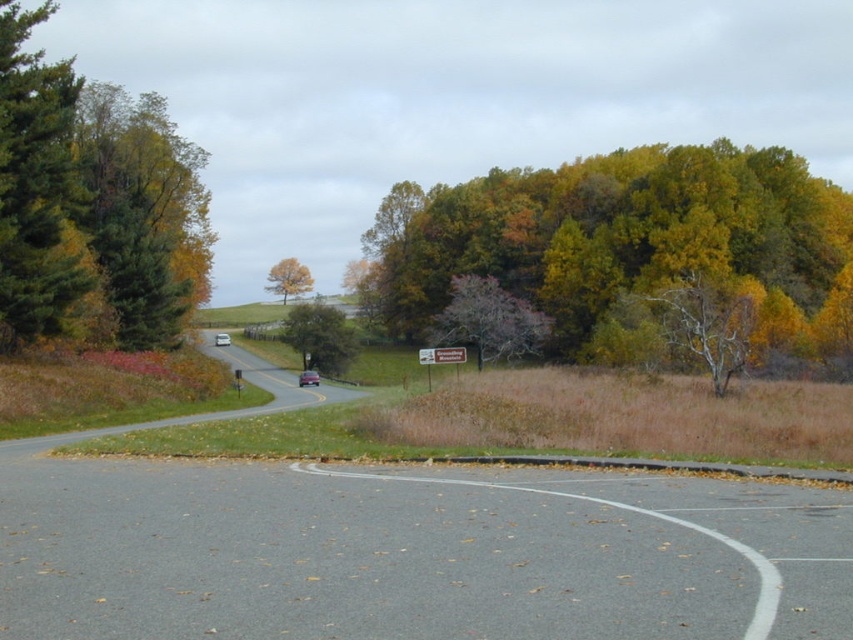
Question: Observing the image, what is the correct spatial positioning of green matte tree at left in reference to pink textured tree at center?

Choices:
 (A) right
 (B) left

Answer: (B)

Question: Which point is closer to the camera taking this photo?

Choices:
 (A) (299, 349)
 (B) (431, 358)
 (C) (402, 481)
 (D) (314, 384)

Answer: (C)

Question: Which object is farther from the camera taking this photo?

Choices:
 (A) metallic silver sedan at center
 (B) yellow-green foliage at upper right

Answer: (A)

Question: Can you confirm if gray asphalt road at center is smaller than matte black car at center?

Choices:
 (A) yes
 (B) no

Answer: (A)

Question: Is gray asphalt road at center above green matte tree at center?

Choices:
 (A) no
 (B) yes

Answer: (A)

Question: Which point is closer to the camera?

Choices:
 (A) (289, 292)
 (B) (38, 260)

Answer: (B)